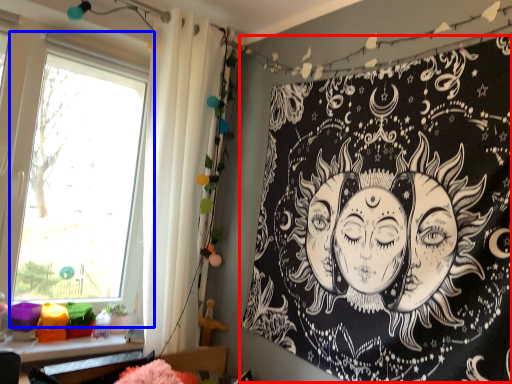
Question: Which object is further to the camera taking this photo, bulletin board (highlighted by a red box) or window (highlighted by a blue box)?

Choices:
 (A) bulletin board
 (B) window

Answer: (B)